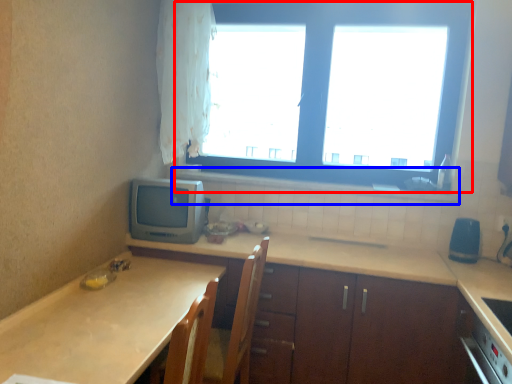
Question: Among these objects, which one is nearest to the camera, window (highlighted by a red box) or window sill (highlighted by a blue box)?

Choices:
 (A) window
 (B) window sill

Answer: (A)